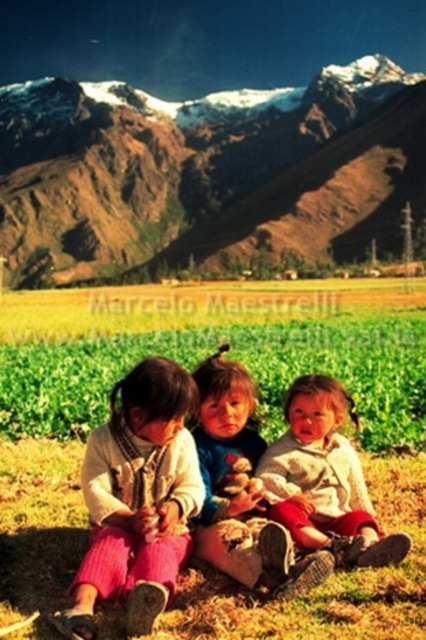
Question: Which point appears closest to the camera in this image?

Choices:
 (A) (230, 576)
 (B) (141, 192)
 (C) (106, 504)

Answer: (A)

Question: Can you confirm if matte pink pants at lower left is bigger than white knit sweater at center?

Choices:
 (A) yes
 (B) no

Answer: (A)

Question: Does rugged brown mountain at upper center appear over matte pink pants at lower left?

Choices:
 (A) no
 (B) yes

Answer: (B)

Question: Based on their relative distances, which object is farther from the white knit sweater at center?

Choices:
 (A) rugged brown mountain at upper center
 (B) soft beige sweater at center

Answer: (A)

Question: Does green grass at center come behind rugged brown mountain at upper center?

Choices:
 (A) yes
 (B) no

Answer: (B)

Question: Which of the following is the closest to the observer?

Choices:
 (A) (51, 230)
 (B) (100, 561)
 (C) (336, 486)
 (D) (209, 628)

Answer: (D)